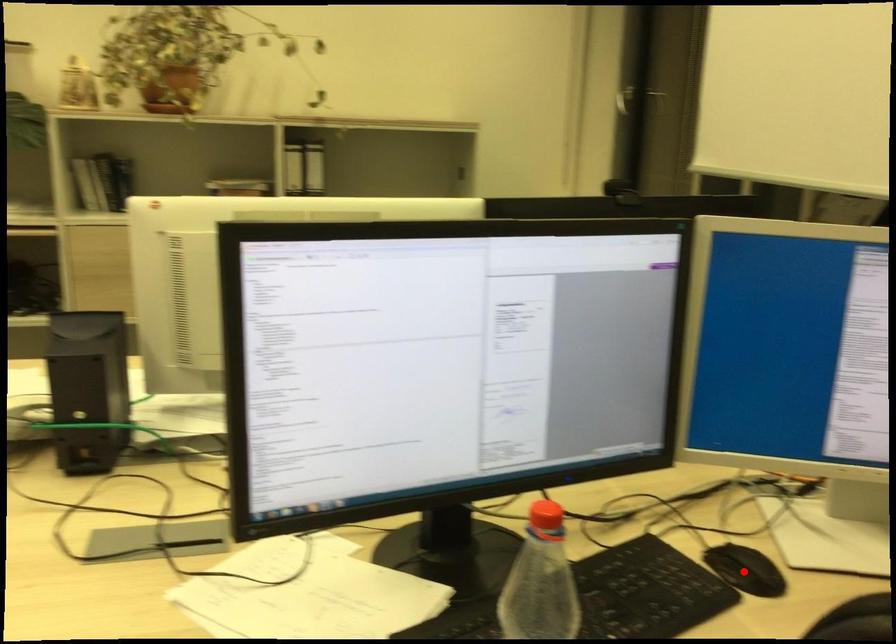
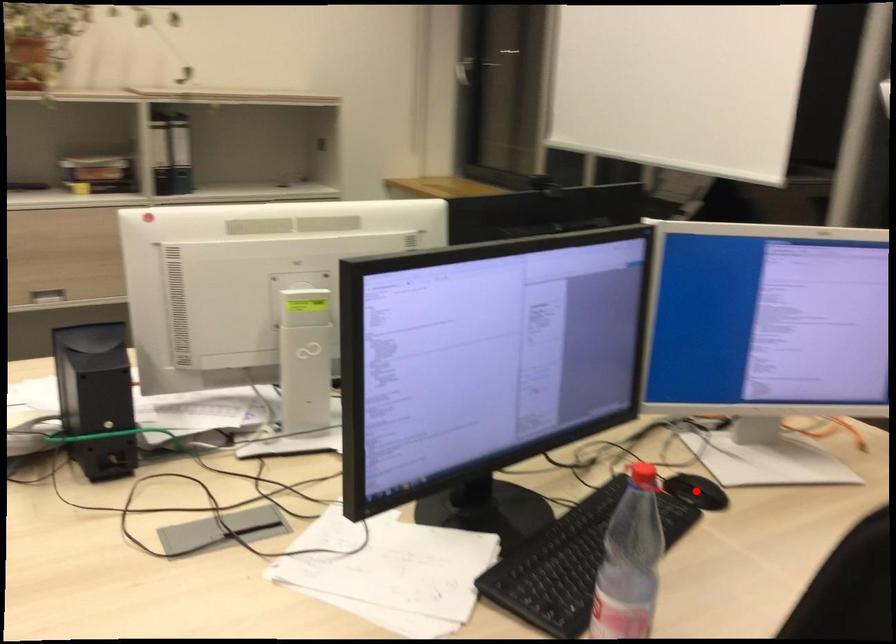
I am providing you with two images of the same scene from different viewpoints. A red point is marked on the first image and another point is marked on the second image. Is the marked point in image1 the same physical position as the marked point in image2?

Yes